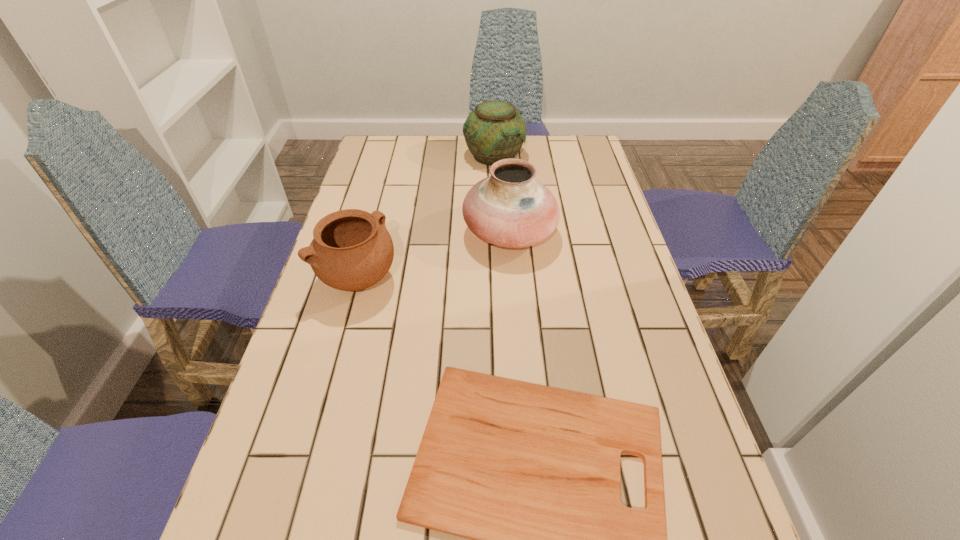
Image resolution: width=960 pixels, height=540 pixels. Find the location of `free space that is in between the farthest object and the leftmost pottery`. free space that is in between the farthest object and the leftmost pottery is located at coordinates (426, 217).

What are the coordinates of `free space between the farthest object and the leftmost object` in the screenshot? It's located at (426, 217).

Locate an element on the screen. This screenshot has width=960, height=540. the second closest object to the farthest object is located at coordinates (352, 250).

Identify which object is the nearest to the leftmost object. Please provide its 2D coordinates. Your answer should be formatted as a tuple, i.e. [(x, y)], where the tuple contains the x and y coordinates of a point satisfying the conditions above.

[(511, 209)]

This screenshot has height=540, width=960. Find the location of `the second closest pottery relative to the farthest object`. the second closest pottery relative to the farthest object is located at coordinates (352, 250).

Identify which pottery is located as the nearest to the leftmost pottery. Please provide its 2D coordinates. Your answer should be formatted as a tuple, i.e. [(x, y)], where the tuple contains the x and y coordinates of a point satisfying the conditions above.

[(511, 209)]